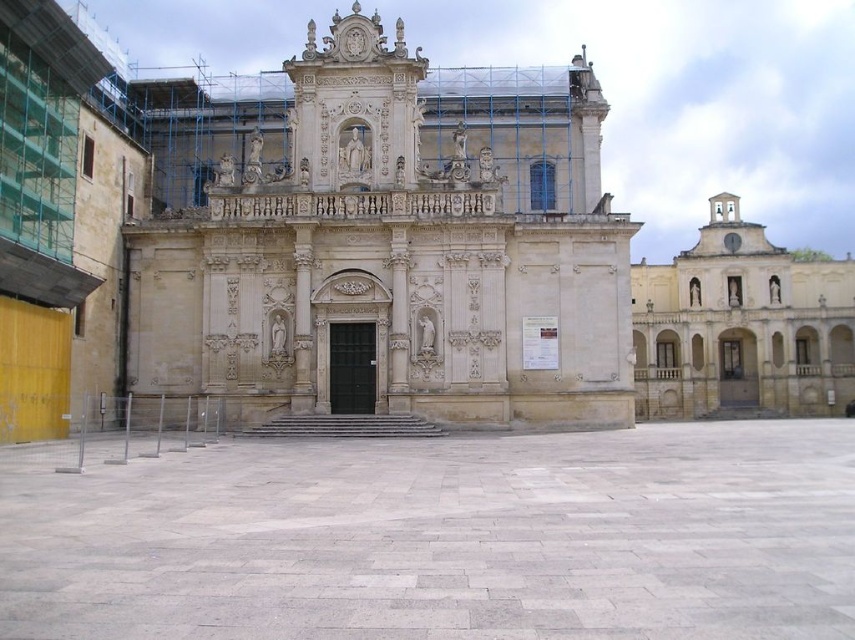
You are standing in the public square and want to take a photo of both the beige stone church at center and the light beige stone church at upper right. Which church should you position yourself closer to in order to capture both in the same frame?

You should position yourself closer to the beige stone church at center because it is to the left of the light beige stone church at upper right, so by moving closer to the left church, you can include both in your photo frame.

You are an architect planning to install a new statue in the gray stone courtyard at center. Considering the space available, will the courtyard be able to accommodate a large statue that requires more space than the light beige stone church at upper right?

The gray stone courtyard at center occupies less space than the light beige stone church at upper right, so it cannot accommodate a large statue requiring more space than the church.

You are standing in the public square and want to take a photo of the beige stone church at center. Where should you position yourself to capture it in the frame?

The beige stone church at center is located at point (396, 252), so you should position yourself in the center of the public square to capture it in the frame.